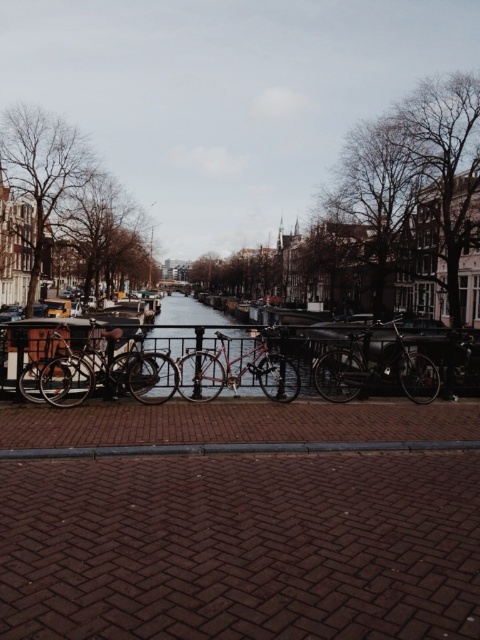
Question: Is metallic waterway at center further to the viewer compared to shiny red bicycle at center?

Choices:
 (A) yes
 (B) no

Answer: (A)

Question: Among these objects, which one is nearest to the camera?

Choices:
 (A) shiny black bicycle at center
 (B) shiny metallic bicycle at center
 (C) metallic waterway at center
 (D) shiny red bicycle at center

Answer: (B)

Question: Which object is farther from the camera taking this photo?

Choices:
 (A) shiny metallic bicycle at center
 (B) metallic waterway at center
 (C) shiny red bicycle at center
 (D) shiny black bicycle at center

Answer: (D)

Question: Which of the following is the farthest from the observer?

Choices:
 (A) (229, 372)
 (B) (68, 394)

Answer: (A)

Question: Where is shiny black bicycle at center located in relation to shiny red bicycle at center in the image?

Choices:
 (A) above
 (B) below

Answer: (B)

Question: Does shiny metallic bicycle at center come behind shiny black bicycle at center?

Choices:
 (A) no
 (B) yes

Answer: (A)